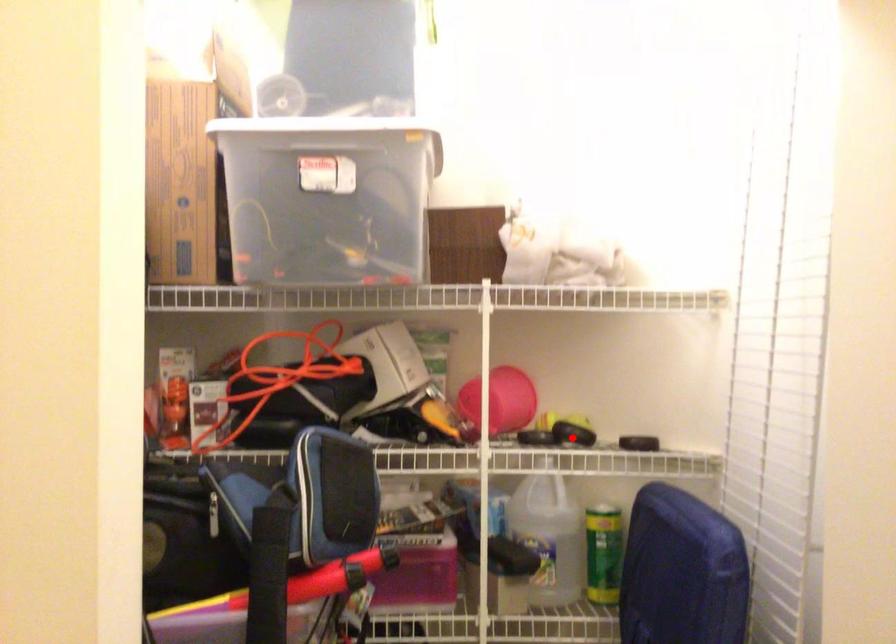
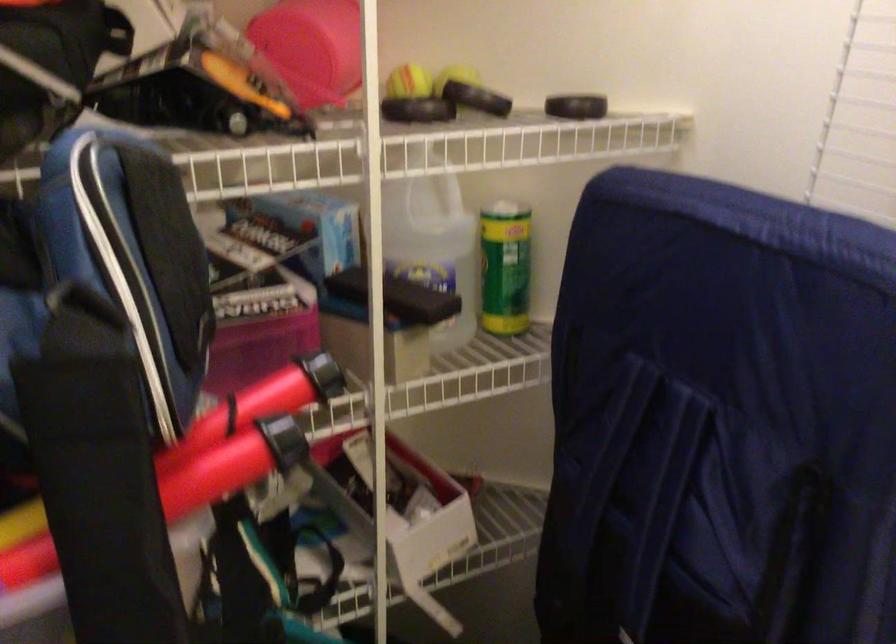
Question: A red point is marked in image1. In image2, is the corresponding 3D point closer to the camera or farther? Reply with the corresponding letter.

Choices:
 (A) The corresponding 3D point is closer.
 (B) The corresponding 3D point is farther.

Answer: (A)